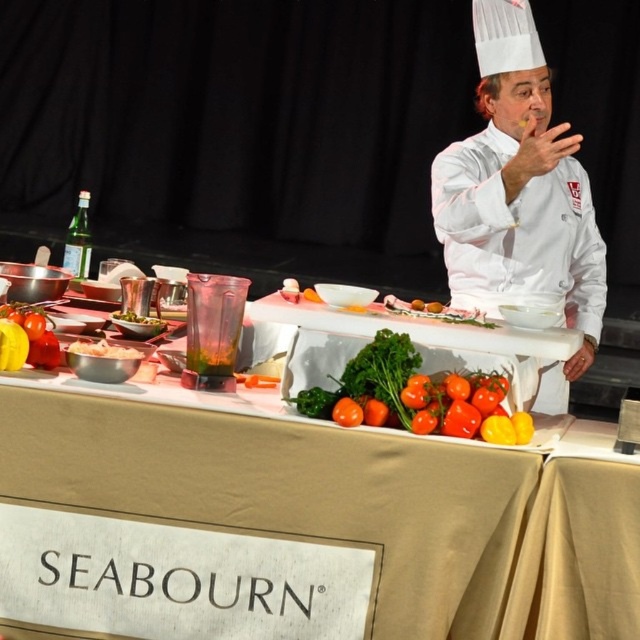
Which is more to the right, white chef coat at upper right or glossy red tomatoes at center?

From the viewer's perspective, white chef coat at upper right appears more on the right side.

Describe the element at coordinates (518, 196) in the screenshot. I see `white chef coat at upper right` at that location.

Find the location of a particular element. white chef coat at upper right is located at coordinates (518, 196).

Measure the distance between white chef coat at upper right and camera.

white chef coat at upper right is 2.25 meters away from camera.

Between point (582, 368) and point (4, 316), which one is positioned in front?

Point (4, 316) is more forward.

Where is `white chef coat at upper right`? white chef coat at upper right is located at coordinates (518, 196).

Does point (449, 426) come behind point (90, 355)?

That is False.

Where is `glossy red tomatoes at center`? The image size is (640, 640). glossy red tomatoes at center is located at coordinates (417, 396).

Find the location of a particular element. glossy red tomatoes at center is located at coordinates point(417,396).